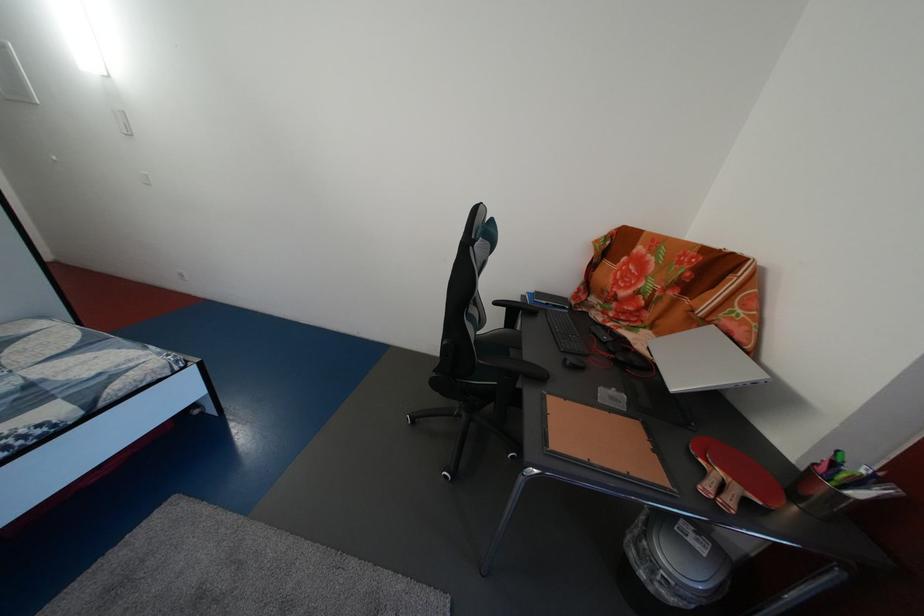
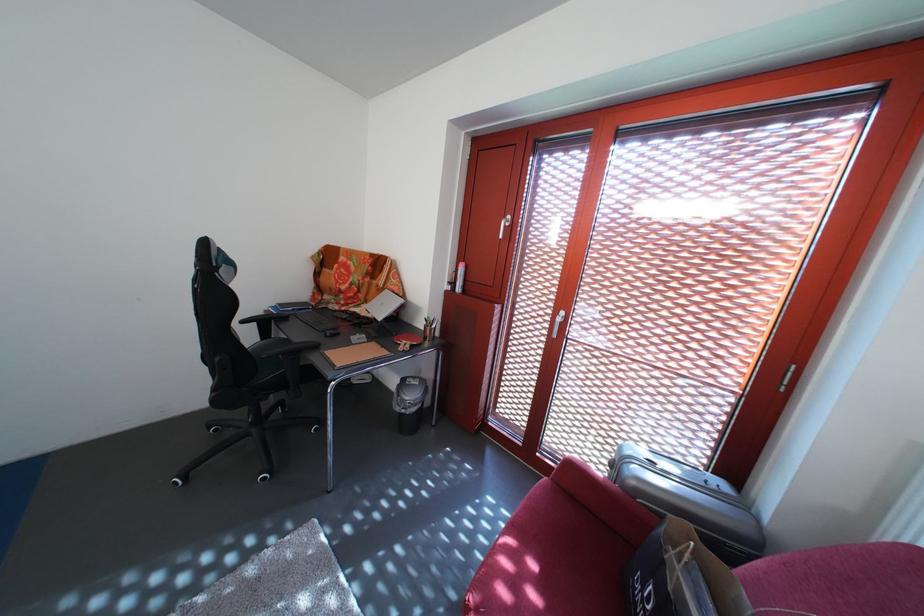
Question: Based on the continuous images, in which direction is the camera rotating? Reply with the corresponding letter.

Choices:
 (A) Left
 (B) Right
 (C) Up
 (D) Down

Answer: (B)